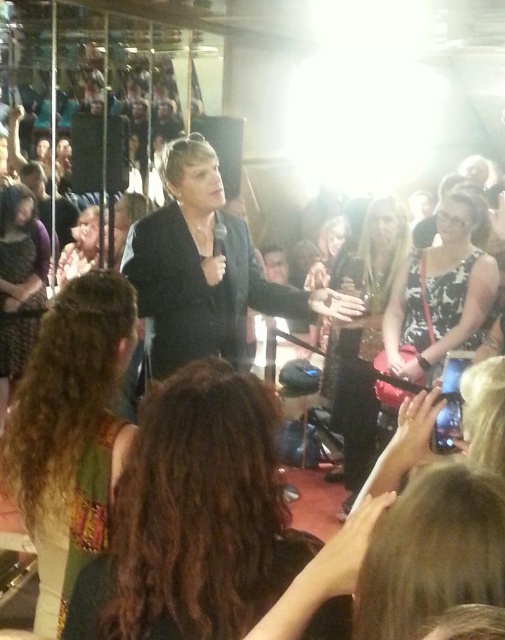
Is point (247, 536) more distant than point (90, 237)?

No, it is in front of (90, 237).

This screenshot has width=505, height=640. What are the coordinates of `brown curly hair at center` in the screenshot? It's located at (193, 516).

Can you confirm if black matte suit at center is bigger than matte black jacket at left?

Yes, black matte suit at center is bigger than matte black jacket at left.

Who is more forward, (172, 230) or (71, 268)?

Point (172, 230) is more forward.

Measure the distance between black matte suit at center and camera.

A distance of 2.29 meters exists between black matte suit at center and camera.

Locate an element on the screen. The width and height of the screenshot is (505, 640). black matte suit at center is located at coordinates (198, 268).

Which is more to the right, matte black dress at left or matte black jacket at left?

matte black jacket at left is more to the right.

Can you confirm if matte black dress at left is positioned to the right of matte black jacket at left?

Incorrect, matte black dress at left is not on the right side of matte black jacket at left.

Between point (17, 212) and point (76, 236), which one is positioned in front?

Point (17, 212)

The height and width of the screenshot is (640, 505). I want to click on matte black dress at left, so click(20, 282).